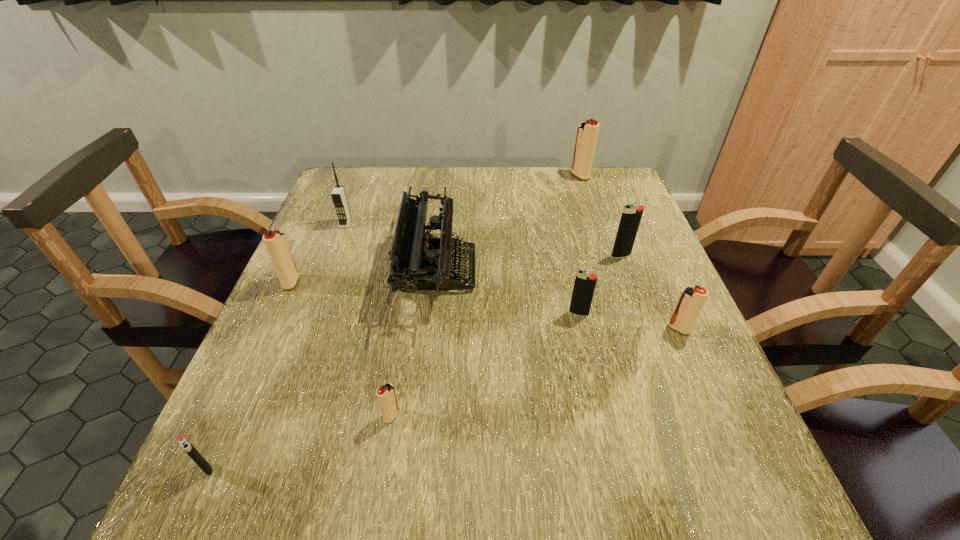
Locate an element on the screen. The image size is (960, 540). the third farthest red igniter is located at coordinates (691, 300).

Where is `the second smallest red igniter`? the second smallest red igniter is located at coordinates (691, 300).

Locate an element on the screen. the second nearest object is located at coordinates (386, 396).

You are a GUI agent. You are given a task and a screenshot of the screen. Output one action in this format:
    pyautogui.click(x=<x>, y=<y>)
    Task: Click on the third igniter from left to right
    The height and width of the screenshot is (540, 960).
    Given the screenshot: What is the action you would take?
    pyautogui.click(x=386, y=396)

Image resolution: width=960 pixels, height=540 pixels. Identify the location of the nearest black igniter. (184, 443).

The height and width of the screenshot is (540, 960). In order to click on the nearest igniter in this screenshot , I will do `click(184, 443)`.

Identify the location of free spot located on the left of the biggest red igniter. (483, 176).

Image resolution: width=960 pixels, height=540 pixels. I want to click on vacant space located 0.270m on the front-facing side of the cellular telephone, so click(316, 303).

Find the location of a particular element. free space located on the back of the third farthest igniter is located at coordinates (304, 255).

The width and height of the screenshot is (960, 540). In order to click on free location located on the left of the biggest black igniter in this screenshot , I will do `click(451, 255)`.